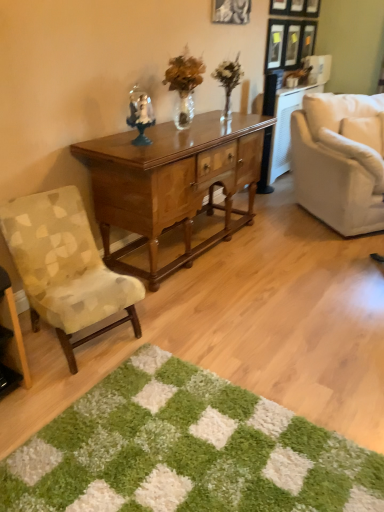
At what (x,y) coordinates should I click in order to perform the action: click on translucent glass vase at center. Please return your answer as a coordinate pair (x, y). The height and width of the screenshot is (512, 384). Looking at the image, I should click on tap(228, 81).

Measure the distance between green shaggy rug at lower center and camera.

green shaggy rug at lower center and camera are 4.30 feet apart.

Locate an element on the screen. The height and width of the screenshot is (512, 384). patterned fabric chair at left, which ranks as the second chair in top-to-bottom order is located at coordinates (65, 267).

Where is `translucent glass vase at center`? Image resolution: width=384 pixels, height=512 pixels. translucent glass vase at center is located at coordinates (228, 81).

Based on the photo, considering the sizes of objects patterned fabric chair at left, which ranks as the second chair in top-to-bottom order, and green shaggy rug at lower center in the image provided, who is smaller, patterned fabric chair at left, which ranks as the second chair in top-to-bottom order, or green shaggy rug at lower center?

green shaggy rug at lower center is smaller.

Relative to green shaggy rug at lower center, is patterned fabric chair at left, which appears as the second chair when viewed from the back, in front or behind?

In the image, patterned fabric chair at left, which appears as the second chair when viewed from the back, appears behind green shaggy rug at lower center.

Is patterned fabric chair at left, which ranks as the second chair in top-to-bottom order, at the right side of green shaggy rug at lower center?

No, patterned fabric chair at left, which ranks as the second chair in top-to-bottom order, is not to the right of green shaggy rug at lower center.

Considering the sizes of objects patterned fabric chair at left, the first chair when ordered from left to right, and green shaggy rug at lower center in the image provided, who is shorter, patterned fabric chair at left, the first chair when ordered from left to right, or green shaggy rug at lower center?

With less height is green shaggy rug at lower center.

From the image's perspective, which is above, green shaggy rug at lower center or polished wood desk at center?

polished wood desk at center is shown above in the image.

From a real-world perspective, is green shaggy rug at lower center physically located above or below polished wood desk at center?

From a real-world perspective, green shaggy rug at lower center is physically below polished wood desk at center.

Is green shaggy rug at lower center not close to polished wood desk at center?

Yes.

Consider the image. Considering their positions, is green shaggy rug at lower center located in front of or behind polished wood desk at center?

In the image, green shaggy rug at lower center appears in front of polished wood desk at center.

Can we say green shaggy rug at lower center lies outside white fabric chair at right, the first chair in the back-to-front sequence?

That's correct, green shaggy rug at lower center is outside of white fabric chair at right, the first chair in the back-to-front sequence.

Can you confirm if green shaggy rug at lower center is smaller than white fabric chair at right, arranged as the 2th chair when viewed from the front?

Yes, green shaggy rug at lower center is smaller than white fabric chair at right, arranged as the 2th chair when viewed from the front.

From the image's perspective, who appears lower, green shaggy rug at lower center or white fabric chair at right, placed as the 2th chair when sorted from left to right?

green shaggy rug at lower center, from the image's perspective.

From a real-world perspective, which object rests below the other?

green shaggy rug at lower center, from a real-world perspective.

Considering the sizes of objects translucent glass vase at center and black matte picture frame at upper center in the image provided, who is wider, translucent glass vase at center or black matte picture frame at upper center?

With larger width is translucent glass vase at center.

Would you say translucent glass vase at center is to the left or to the right of black matte picture frame at upper center in the picture?

Clearly, translucent glass vase at center is on the left of black matte picture frame at upper center in the image.

What's the angular difference between translucent glass vase at center and black matte picture frame at upper center's facing directions?

There is a 0.24-degree angle between the facing directions of translucent glass vase at center and black matte picture frame at upper center.

Which is closer, (227,72) or (224,21)?

The point (227,72) is in front.

Which of these two, white fabric chair at right, positioned as the first chair in top-to-bottom order, or patterned fabric chair at left, the first chair ordered from the bottom, is smaller?

Smaller between the two is patterned fabric chair at left, the first chair ordered from the bottom.

Is point (349, 220) closer or farther from the camera than point (74, 372)?

Point (349, 220) appears to be farther away from the viewer than point (74, 372).

Could you measure the distance between white fabric chair at right, which is the first chair from right to left, and patterned fabric chair at left, which is counted as the second chair, starting from the right?

The distance of white fabric chair at right, which is the first chair from right to left, from patterned fabric chair at left, which is counted as the second chair, starting from the right, is 6.55 feet.

Is black matte picture frame at upper center closer to camera compared to white fabric chair at right, positioned as the first chair in top-to-bottom order?

That is False.

Which is less distant, (216,10) or (374,166)?

Positioned in front is point (374,166).

Is white fabric chair at right, placed as the 2th chair when sorted from left to right, completely or partially inside black matte picture frame at upper center?

Definitely not — white fabric chair at right, placed as the 2th chair when sorted from left to right, is not inside black matte picture frame at upper center.

Does black matte picture frame at upper center have a larger size compared to white fabric chair at right, placed as the 2th chair when sorted from left to right?

Incorrect, black matte picture frame at upper center is not larger than white fabric chair at right, placed as the 2th chair when sorted from left to right.

From a real-world perspective, relative to white fabric chair at right, positioned as the first chair in top-to-bottom order, is patterned fabric chair at left, which ranks as the second chair in top-to-bottom order, vertically above or below?

Clearly, from a real-world perspective, patterned fabric chair at left, which ranks as the second chair in top-to-bottom order, is below white fabric chair at right, positioned as the first chair in top-to-bottom order.

Considering the relative sizes of patterned fabric chair at left, the first chair when ordered from left to right, and white fabric chair at right, which is the first chair from right to left, in the image provided, is patterned fabric chair at left, the first chair when ordered from left to right, smaller than white fabric chair at right, which is the first chair from right to left,?

Yes.

The image size is (384, 512). I want to click on chair above the patterned fabric chair at left, the first chair when ordered from left to right (from the image's perspective), so click(340, 160).

Where is `the 1st chair directly above the green shaggy rug at lower center (from a real-world perspective)`? This screenshot has width=384, height=512. the 1st chair directly above the green shaggy rug at lower center (from a real-world perspective) is located at coordinates (65, 267).

What are the coordinates of `desk that is above the green shaggy rug at lower center (from the image's perspective)` in the screenshot? It's located at (172, 183).

Considering their positions, is white fabric chair at right, positioned as the first chair in top-to-bottom order, positioned closer to green shaggy rug at lower center than patterned fabric chair at left, which is the 1th chair from front to back?

Among the two, patterned fabric chair at left, which is the 1th chair from front to back, is located nearer to green shaggy rug at lower center.

Which object lies nearer to the anchor point patterned fabric chair at left, the first chair when ordered from left to right, green shaggy rug at lower center or black matte picture frame at upper center?

Based on the image, green shaggy rug at lower center appears to be nearer to patterned fabric chair at left, the first chair when ordered from left to right.

Which object lies further to the anchor point black matte picture frame at upper center, white fabric chair at right, arranged as the 2th chair when viewed from the front, or patterned fabric chair at left, which appears as the second chair when viewed from the back?

The object further to black matte picture frame at upper center is patterned fabric chair at left, which appears as the second chair when viewed from the back.

Estimate the real-world distances between objects in this image. Which object is further from white fabric chair at right, arranged as the 2th chair when viewed from the front, polished wood desk at center or green shaggy rug at lower center?

The object further to white fabric chair at right, arranged as the 2th chair when viewed from the front, is green shaggy rug at lower center.

Considering their positions, is black matte picture frame at upper center positioned further to polished wood desk at center than green shaggy rug at lower center?

Among the two, green shaggy rug at lower center is located further to polished wood desk at center.

Which object lies nearer to the anchor point patterned fabric chair at left, the first chair ordered from the bottom, green shaggy rug at lower center or polished wood desk at center?

polished wood desk at center is closer to patterned fabric chair at left, the first chair ordered from the bottom.

When comparing their distances from black matte picture frame at upper center, does translucent glass vase at center or patterned fabric chair at left, the first chair ordered from the bottom, seem closer?

Among the two, translucent glass vase at center is located nearer to black matte picture frame at upper center.

In the scene shown: Which object lies further to the anchor point translucent glass vase at center, white fabric chair at right, positioned as the first chair in top-to-bottom order, or polished wood desk at center?

Result: The object further to translucent glass vase at center is white fabric chair at right, positioned as the first chair in top-to-bottom order.

The width and height of the screenshot is (384, 512). Identify the location of houseplant that lies between black matte picture frame at upper center and green shaggy rug at lower center from top to bottom. click(228, 81).

The width and height of the screenshot is (384, 512). Identify the location of houseplant between black matte picture frame at upper center and polished wood desk at center from top to bottom. (x=228, y=81).

Image resolution: width=384 pixels, height=512 pixels. What are the coordinates of `houseplant between polished wood desk at center and white fabric chair at right, the first chair in the back-to-front sequence, from left to right` in the screenshot? It's located at (228, 81).

Locate an element on the screen. The height and width of the screenshot is (512, 384). desk between patterned fabric chair at left, which is the 1th chair from front to back, and white fabric chair at right, which is the first chair from right to left is located at coordinates (172, 183).